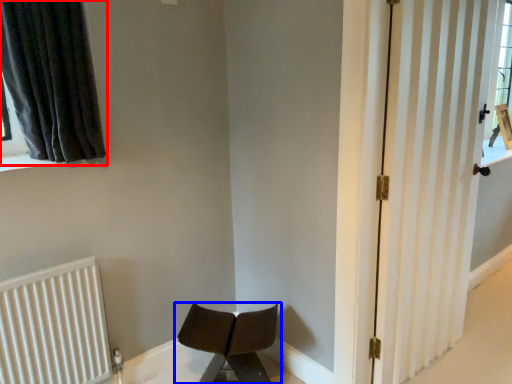
Question: Which of the following is the closest to the observer, curtain (highlighted by a red box) or chair (highlighted by a blue box)?

Choices:
 (A) curtain
 (B) chair

Answer: (A)